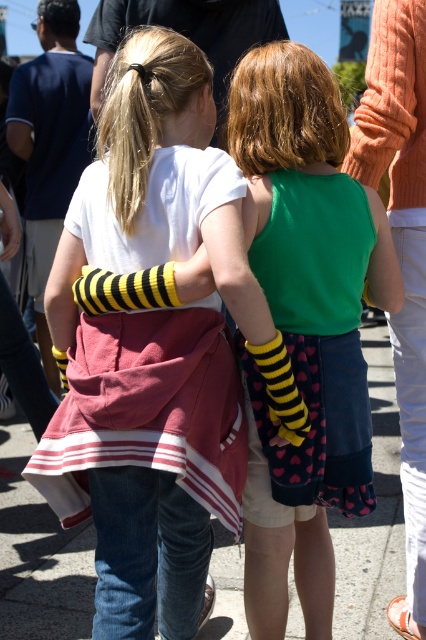
Question: Which of the following is the closest to the observer?

Choices:
 (A) green fabric dress at center
 (B) white cotton shirt at center

Answer: (B)

Question: Does white cotton shirt at center appear under green fabric dress at center?

Choices:
 (A) yes
 (B) no

Answer: (B)

Question: Which of the following is the farthest from the observer?

Choices:
 (A) green fabric dress at center
 (B) white cotton shirt at center

Answer: (A)

Question: Can you confirm if white cotton shirt at center is smaller than green fabric dress at center?

Choices:
 (A) no
 (B) yes

Answer: (A)

Question: Is the position of white cotton shirt at center more distant than that of green fabric dress at center?

Choices:
 (A) yes
 (B) no

Answer: (B)